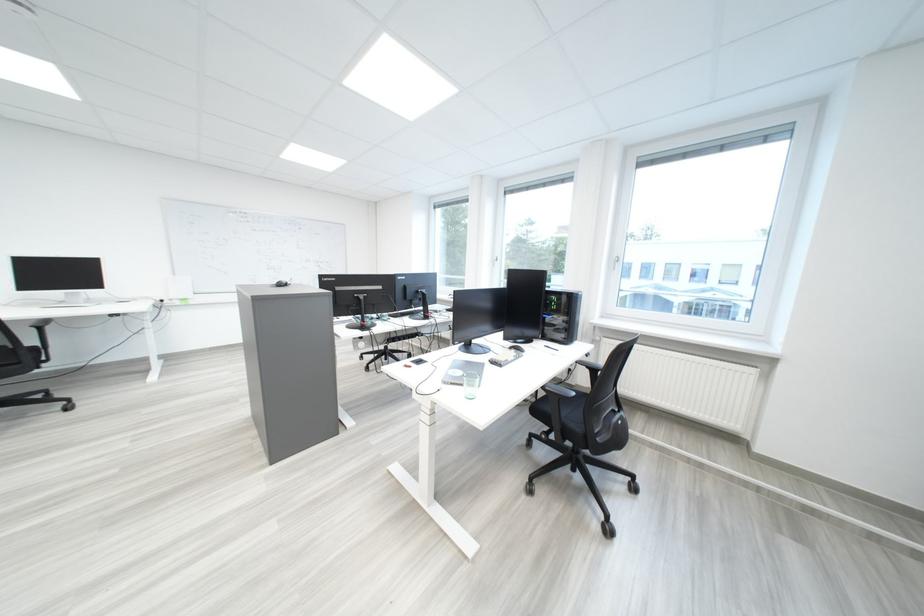
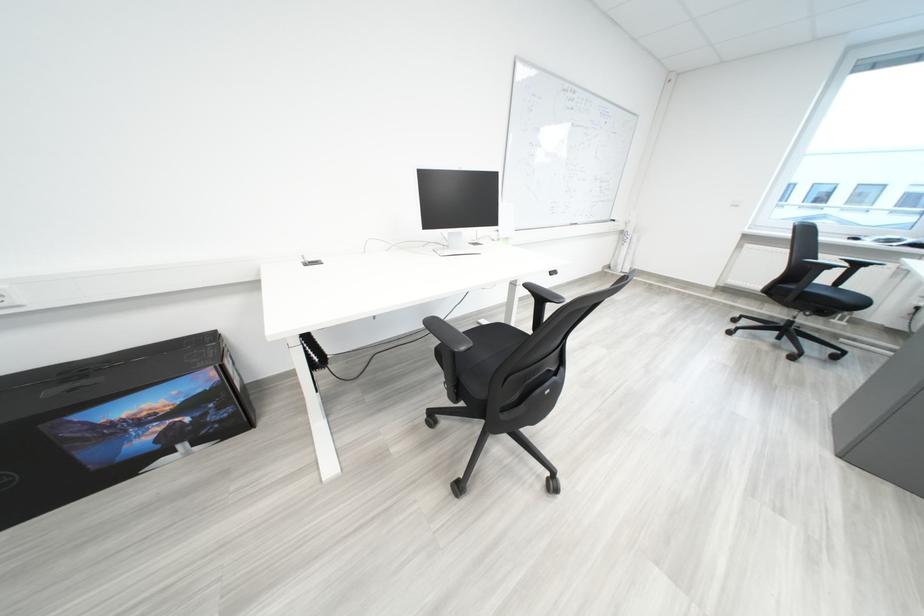
Question: In a continuous first-person perspective shot, in which direction is the camera moving?

Choices:
 (A) Left
 (B) Right
 (C) Forward
 (D) Backward

Answer: (A)